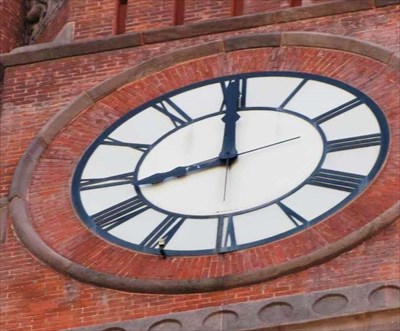
The image size is (400, 331). What are the coordinates of `clock hands` in the screenshot? It's located at (235, 190).